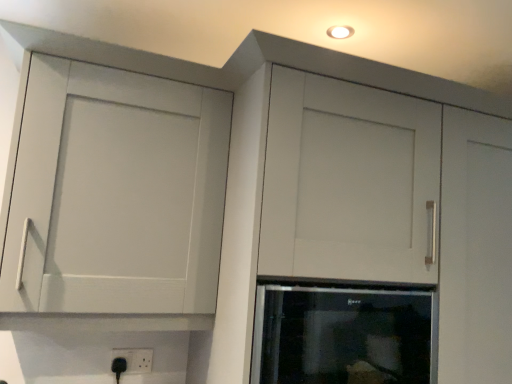
Question: Can you confirm if matte white cupboard at upper left is bigger than black glass oven at center?

Choices:
 (A) no
 (B) yes

Answer: (B)

Question: Considering the relative sizes of matte white cupboard at upper left and black glass oven at center in the image provided, is matte white cupboard at upper left shorter than black glass oven at center?

Choices:
 (A) yes
 (B) no

Answer: (B)

Question: Can we say matte white cupboard at upper left lies outside black glass oven at center?

Choices:
 (A) no
 (B) yes

Answer: (B)

Question: Could you tell me if matte white cupboard at upper left is facing black glass oven at center?

Choices:
 (A) yes
 (B) no

Answer: (B)

Question: Are matte white cupboard at upper left and black glass oven at center located far from each other?

Choices:
 (A) yes
 (B) no

Answer: (B)

Question: Is matte white cupboard at upper left facing away from black glass oven at center?

Choices:
 (A) no
 (B) yes

Answer: (A)

Question: Does black plastic electric outlet at lower center lie in front of black glass oven at center?

Choices:
 (A) no
 (B) yes

Answer: (A)

Question: Can black glass oven at center be found inside black plastic electric outlet at lower center?

Choices:
 (A) yes
 (B) no

Answer: (B)

Question: Does black plastic electric outlet at lower center have a lesser width compared to black glass oven at center?

Choices:
 (A) yes
 (B) no

Answer: (A)

Question: From the image's perspective, is black plastic electric outlet at lower center located above black glass oven at center?

Choices:
 (A) yes
 (B) no

Answer: (B)

Question: Does black plastic electric outlet at lower center have a greater height compared to black glass oven at center?

Choices:
 (A) yes
 (B) no

Answer: (B)

Question: Is black plastic electric outlet at lower center located outside black glass oven at center?

Choices:
 (A) yes
 (B) no

Answer: (A)

Question: Would you say black glass oven at center is a long distance from matte white cupboard at upper left?

Choices:
 (A) yes
 (B) no

Answer: (B)